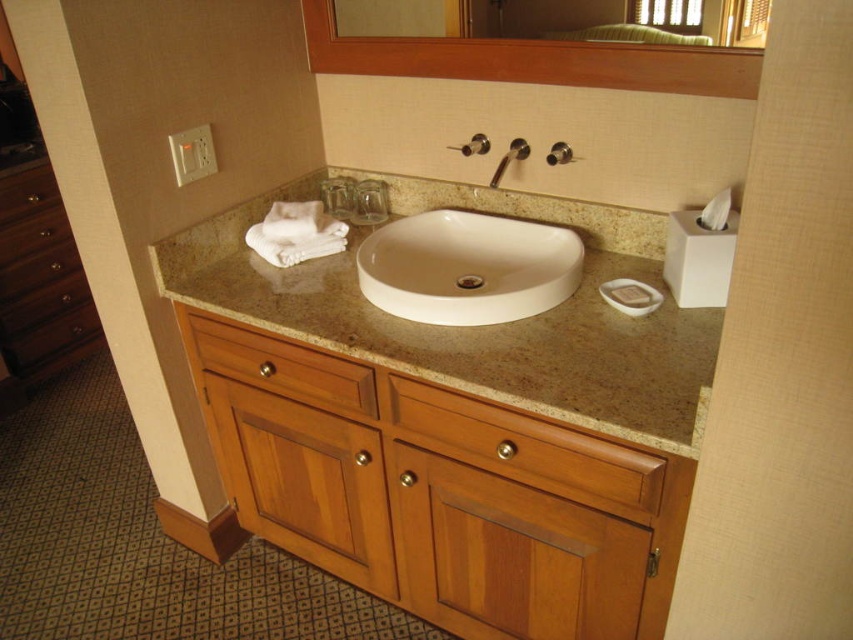
Consider the image. Can you confirm if beige granite countertop at center is positioned to the right of wooden frame at upper center?

No, beige granite countertop at center is not to the right of wooden frame at upper center.

Does beige granite countertop at center appear under wooden frame at upper center?

Yes.

The height and width of the screenshot is (640, 853). Find the location of `beige granite countertop at center`. beige granite countertop at center is located at coordinates (479, 326).

Which of these two, white ceramic sink at center or wooden drawer at lower center, stands shorter?

Standing shorter between the two is wooden drawer at lower center.

Can you confirm if white ceramic sink at center is bigger than wooden drawer at lower center?

Correct, white ceramic sink at center is larger in size than wooden drawer at lower center.

Identify the location of white ceramic sink at center. (467, 268).

Is point (393, 310) positioned in front of point (723, 204)?

No, (393, 310) is behind (723, 204).

What do you see at coordinates (467, 268) in the screenshot? I see `white ceramic sink at center` at bounding box center [467, 268].

At what (x,y) coordinates should I click in order to perform the action: click on white ceramic sink at center. Please return your answer as a coordinate pair (x, y). Looking at the image, I should click on (467, 268).

This screenshot has width=853, height=640. Identify the location of white ceramic sink at center. (467, 268).